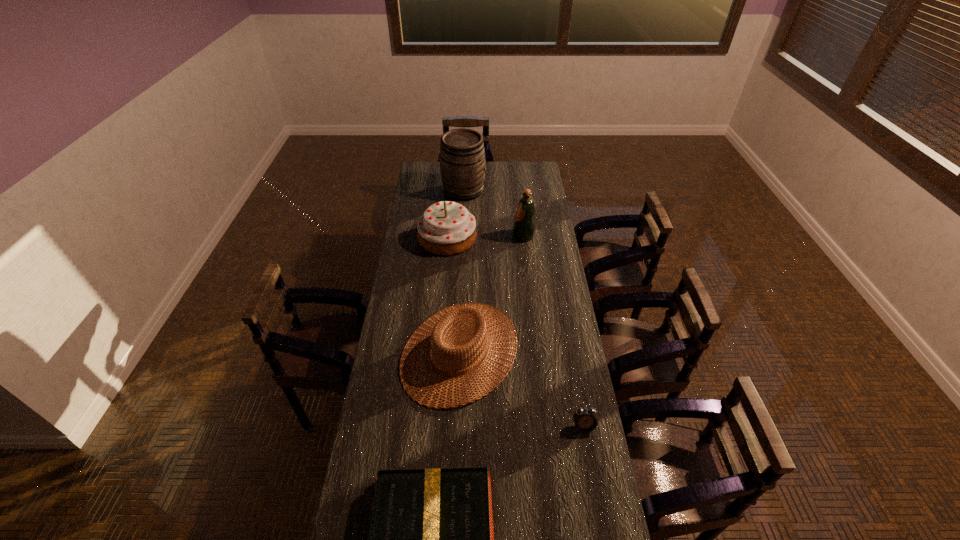
Identify the location of the farthest object. The height and width of the screenshot is (540, 960). (462, 156).

In order to click on wine bucket in this screenshot , I will do `click(462, 156)`.

Find the location of a particular element. The image size is (960, 540). the second tallest object is located at coordinates (524, 224).

Locate an element on the screen. The width and height of the screenshot is (960, 540). olive oil is located at coordinates pos(524,224).

This screenshot has width=960, height=540. In order to click on the third tallest object in this screenshot , I will do `click(446, 228)`.

Locate an element on the screen. sunhat is located at coordinates (478, 319).

I want to click on the third shortest object, so click(x=478, y=319).

You are a GUI agent. You are given a task and a screenshot of the screen. Output one action in this format:
    pyautogui.click(x=<x>, y=<y>)
    Task: Click on the fifth farthest object
    
    Given the screenshot: What is the action you would take?
    pyautogui.click(x=585, y=420)

This screenshot has width=960, height=540. Identify the location of the rightmost object. (585, 420).

You are a GUI agent. You are given a task and a screenshot of the screen. Output one action in this format:
    pyautogui.click(x=<x>, y=<y>)
    Task: Click on the free spot located on the front of the farthest object
    The width and height of the screenshot is (960, 540).
    Given the screenshot: What is the action you would take?
    pyautogui.click(x=462, y=226)